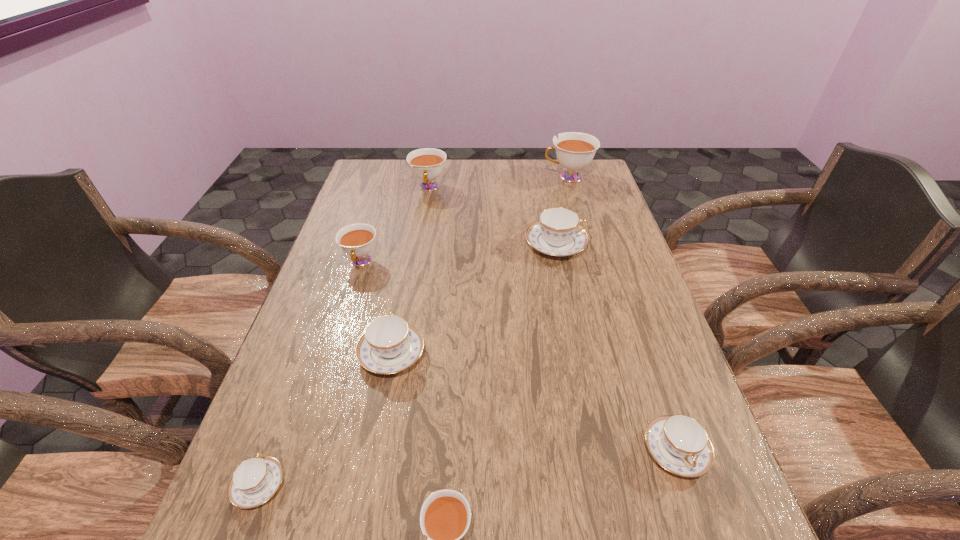
The width and height of the screenshot is (960, 540). Find the location of `the rightmost white teacup`. the rightmost white teacup is located at coordinates (574, 150).

You are a GUI agent. You are given a task and a screenshot of the screen. Output one action in this format:
    pyautogui.click(x=<x>, y=<y>)
    Task: Click on the tallest teacup
    The width and height of the screenshot is (960, 540).
    Given the screenshot: What is the action you would take?
    pyautogui.click(x=574, y=150)

Identify the location of the second tallest object. Image resolution: width=960 pixels, height=540 pixels. (427, 164).

Image resolution: width=960 pixels, height=540 pixels. Identify the location of the third white teacup from right to left. (427, 164).

The width and height of the screenshot is (960, 540). I want to click on the biggest blue teacup, so click(557, 232).

Find the location of `the second smallest white teacup`. the second smallest white teacup is located at coordinates (357, 240).

Locate an element on the screen. This screenshot has height=540, width=960. the second nearest white teacup is located at coordinates click(357, 240).

At what (x,y) coordinates should I click in order to perform the action: click on the third blue teacup from right to left. Please return your answer as a coordinate pair (x, y). Looking at the image, I should click on (389, 344).

Locate an element on the screen. This screenshot has width=960, height=540. the fifth farthest object is located at coordinates (389, 344).

Locate an element on the screen. Image resolution: width=960 pixels, height=540 pixels. the second smallest blue teacup is located at coordinates (679, 443).